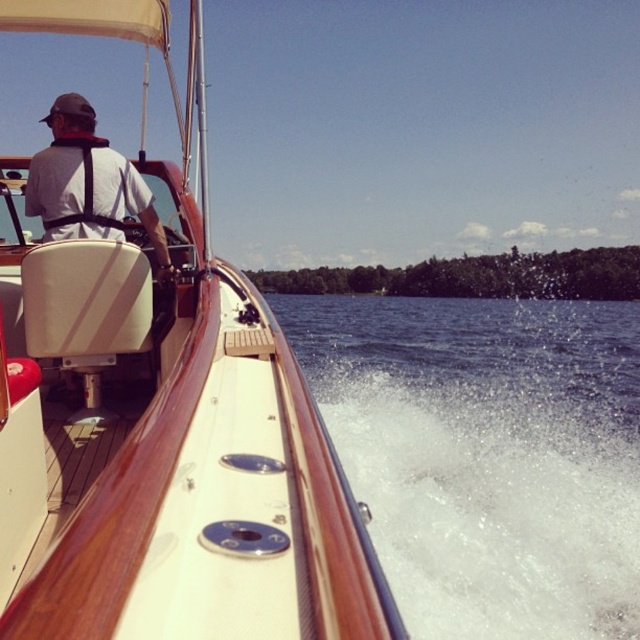
Who is higher up, wooden polished boat at center or white frothy water at lower right?

white frothy water at lower right is higher up.

Who is more distant from viewer, (262, 451) or (400, 593)?

The point (400, 593) is more distant.

Does point (88, 365) come closer to viewer compared to point (502, 349)?

Yes, it is in front of point (502, 349).

What are the coordinates of `wooden polished boat at center` in the screenshot? It's located at (157, 406).

Can you confirm if wooden polished boat at center is wider than matte black harness at center?

Correct, the width of wooden polished boat at center exceeds that of matte black harness at center.

Is wooden polished boat at center further to the viewer compared to matte black harness at center?

No.

Is point (22, 298) more distant than point (64, 198)?

No, it is in front of (64, 198).

At what (x,y) coordinates should I click in order to perform the action: click on wooden polished boat at center. Please return your answer as a coordinate pair (x, y). This screenshot has height=640, width=640. Looking at the image, I should click on (157, 406).

Is white frothy water at lower right wider than matte black harness at center?

Yes.

Is point (609, 573) in front of point (54, 104)?

No, (609, 573) is behind (54, 104).

Who is more forward, [529,436] or [99,227]?

Point [99,227]

Where is `white frothy water at lower right`? The height and width of the screenshot is (640, 640). white frothy water at lower right is located at coordinates (486, 454).